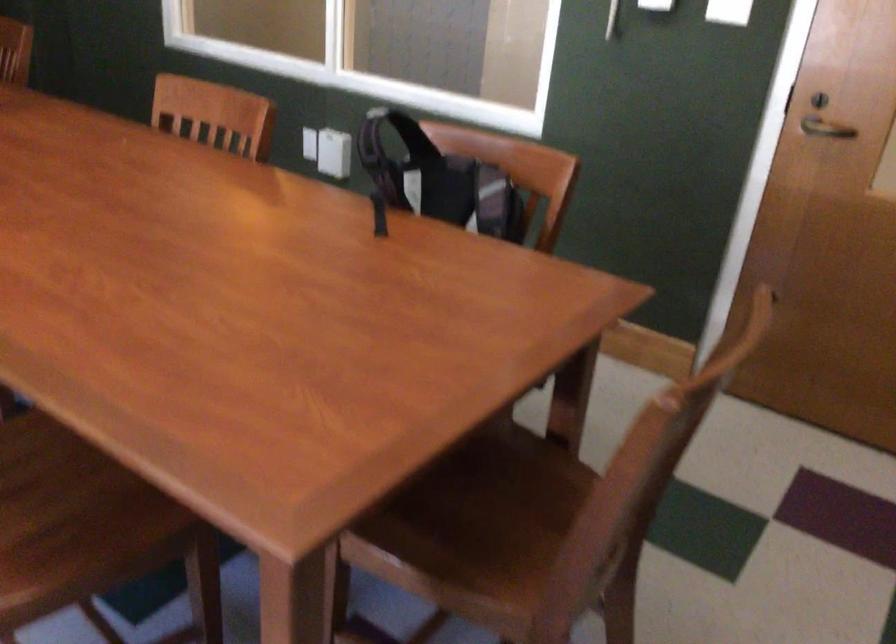
Find where to push the white light switch. Please return your answer as a coordinate pair (x, y).

(333, 153)